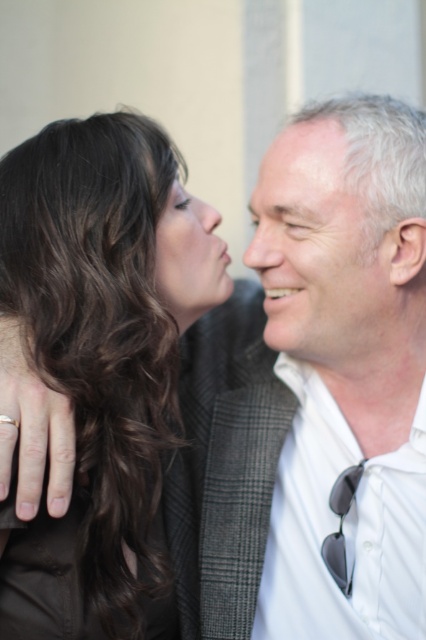
Question: Which object appears closest to the camera in this image?

Choices:
 (A) matte black hair at upper left
 (B) gray checkered suit at center
 (C) dark brown hair at left

Answer: (C)

Question: Where is white matte face at center located in relation to matte black hair at upper left in the image?

Choices:
 (A) right
 (B) left

Answer: (A)

Question: Which object appears closest to the camera in this image?

Choices:
 (A) matte black hair at upper left
 (B) gray checkered suit at center
 (C) gray matte forehead at upper center

Answer: (C)

Question: Which of the following is the closest to the observer?

Choices:
 (A) (302, 458)
 (B) (299, 163)

Answer: (B)

Question: Can you confirm if dark brown hair at left is bigger than gray matte forehead at upper center?

Choices:
 (A) yes
 (B) no

Answer: (A)

Question: Can you confirm if matte black hair at upper left is thinner than gray matte forehead at upper center?

Choices:
 (A) yes
 (B) no

Answer: (A)